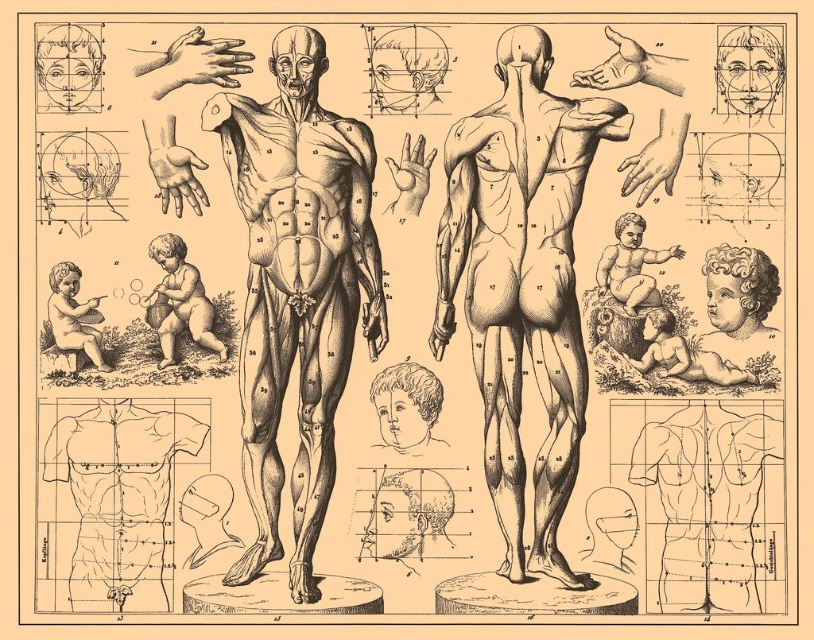
Question: Observing the image, what is the correct spatial positioning of black ink anatomical figure at center in reference to smooth beige baby at lower right?

Choices:
 (A) left
 (B) right

Answer: (A)

Question: Among these points, which one is farthest from the camera?

Choices:
 (A) (50, 317)
 (B) (243, 387)
 (C) (173, 248)

Answer: (A)

Question: Considering the real-world distances, which object is farthest from the smooth beige baby at lower right?

Choices:
 (A) black ink drawing of human body at center
 (B) smooth beige cherub at bottom left
 (C) smooth beige baby at lower left

Answer: (B)

Question: Can you confirm if black ink anatomical figure at center is bigger than black ink drawing of human body at center?

Choices:
 (A) yes
 (B) no

Answer: (A)

Question: Among these points, which one is farthest from the camera?

Choices:
 (A) (554, 147)
 (B) (610, 280)

Answer: (B)

Question: Does black ink anatomical figure at center come in front of black ink drawing of human body at center?

Choices:
 (A) yes
 (B) no

Answer: (A)